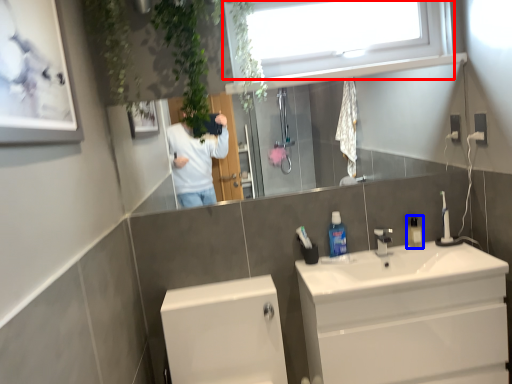
Question: Which object is closer to the camera taking this photo, window (highlighted by a red box) or mouthwash (highlighted by a blue box)?

Choices:
 (A) window
 (B) mouthwash

Answer: (A)